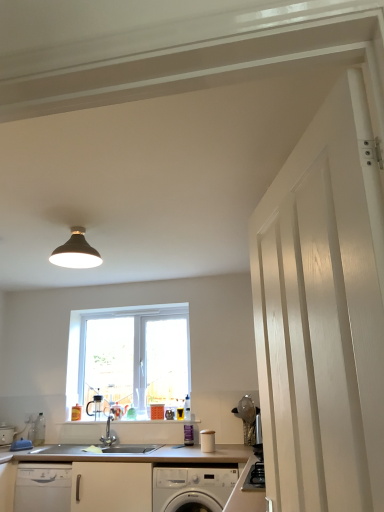
Question: Should I look upward or downward to see matte black light fixture at upper center?

Choices:
 (A) down
 (B) up

Answer: (B)

Question: Is white wood door at right not within matte black light fixture at upper center?

Choices:
 (A) no
 (B) yes

Answer: (B)

Question: From the image's perspective, is white wood door at right on top of matte black light fixture at upper center?

Choices:
 (A) no
 (B) yes

Answer: (A)

Question: Is there a large distance between white wood door at right and matte black light fixture at upper center?

Choices:
 (A) yes
 (B) no

Answer: (A)

Question: Is white wood door at right to the left of matte black light fixture at upper center from the viewer's perspective?

Choices:
 (A) no
 (B) yes

Answer: (A)

Question: From the image's perspective, is white wood door at right under matte black light fixture at upper center?

Choices:
 (A) yes
 (B) no

Answer: (A)

Question: Is white wood door at right smaller than matte black light fixture at upper center?

Choices:
 (A) yes
 (B) no

Answer: (B)

Question: From the image's perspective, would you say white plastic window at center is shown under white glossy washing machine at lower center?

Choices:
 (A) no
 (B) yes

Answer: (A)

Question: Is white plastic window at center thinner than white glossy washing machine at lower center?

Choices:
 (A) yes
 (B) no

Answer: (A)

Question: Is white plastic window at center facing towards white glossy washing machine at lower center?

Choices:
 (A) no
 (B) yes

Answer: (A)

Question: Considering the relative sizes of white plastic window at center and white glossy washing machine at lower center in the image provided, is white plastic window at center taller than white glossy washing machine at lower center?

Choices:
 (A) no
 (B) yes

Answer: (B)

Question: Considering the relative sizes of white plastic window at center and white glossy washing machine at lower center in the image provided, is white plastic window at center wider than white glossy washing machine at lower center?

Choices:
 (A) yes
 (B) no

Answer: (B)

Question: Is white plastic window at center smaller than white glossy washing machine at lower center?

Choices:
 (A) yes
 (B) no

Answer: (A)

Question: Considering the relative sizes of white wood door at right and satin nickel faucet at center in the image provided, is white wood door at right taller than satin nickel faucet at center?

Choices:
 (A) no
 (B) yes

Answer: (B)